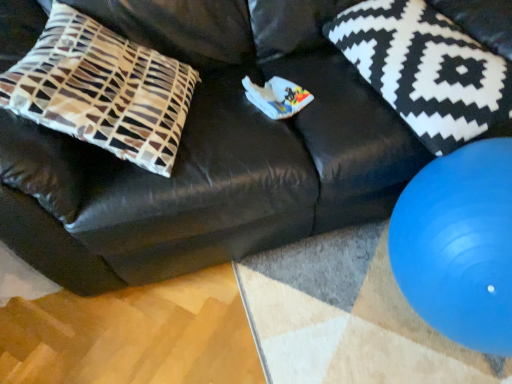
Question: Can you confirm if blue rubber ball at lower right is shorter than black and white patterned pillow at upper right, the first pillow from the right?

Choices:
 (A) yes
 (B) no

Answer: (B)

Question: Is blue rubber ball at lower right bigger than black and white patterned pillow at upper right, the 2th pillow positioned from the left?

Choices:
 (A) yes
 (B) no

Answer: (A)

Question: From a real-world perspective, does blue rubber ball at lower right stand above black and white patterned pillow at upper right, the 2th pillow positioned from the left?

Choices:
 (A) no
 (B) yes

Answer: (A)

Question: Is blue rubber ball at lower right facing towards black and white patterned pillow at upper right, the first pillow from the right?

Choices:
 (A) no
 (B) yes

Answer: (A)

Question: Is black and white patterned pillow at upper right, the 2th pillow positioned from the left, a part of blue rubber ball at lower right?

Choices:
 (A) yes
 (B) no

Answer: (B)

Question: Can you confirm if blue rubber ball at lower right is smaller than black and white patterned pillow at upper right, the first pillow from the right?

Choices:
 (A) yes
 (B) no

Answer: (B)

Question: Considering the relative positions of black and white patterned pillow at upper right, the first pillow from the right, and brown and white patterned pillow at left, the 2th pillow from the right, in the image provided, is black and white patterned pillow at upper right, the first pillow from the right, behind brown and white patterned pillow at left, the 2th pillow from the right,?

Choices:
 (A) no
 (B) yes

Answer: (B)

Question: Is black and white patterned pillow at upper right, the 2th pillow positioned from the left, to the right of brown and white patterned pillow at left, which ranks as the 1th pillow in left-to-right order, from the viewer's perspective?

Choices:
 (A) no
 (B) yes

Answer: (B)

Question: From the image's perspective, is black and white patterned pillow at upper right, the 2th pillow positioned from the left, under brown and white patterned pillow at left, the 2th pillow from the right?

Choices:
 (A) yes
 (B) no

Answer: (B)

Question: From a real-world perspective, does black and white patterned pillow at upper right, the first pillow from the right, sit lower than brown and white patterned pillow at left, which ranks as the 1th pillow in left-to-right order?

Choices:
 (A) yes
 (B) no

Answer: (A)

Question: Is black and white patterned pillow at upper right, the first pillow from the right, beside brown and white patterned pillow at left, which ranks as the 1th pillow in left-to-right order?

Choices:
 (A) no
 (B) yes

Answer: (A)

Question: Is black and white patterned pillow at upper right, the 2th pillow positioned from the left, smaller than brown and white patterned pillow at left, which ranks as the 1th pillow in left-to-right order?

Choices:
 (A) no
 (B) yes

Answer: (B)

Question: From a real-world perspective, is brown and white patterned pillow at left, the 2th pillow from the right, over blue rubber ball at lower right?

Choices:
 (A) no
 (B) yes

Answer: (B)